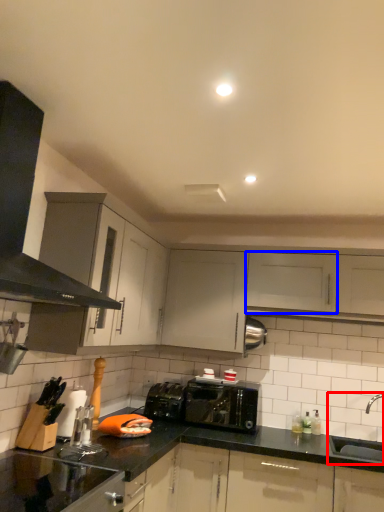
Question: Which object appears closest to the camera in this image, sink (highlighted by a red box) or cabinetry (highlighted by a blue box)?

Choices:
 (A) sink
 (B) cabinetry

Answer: (A)